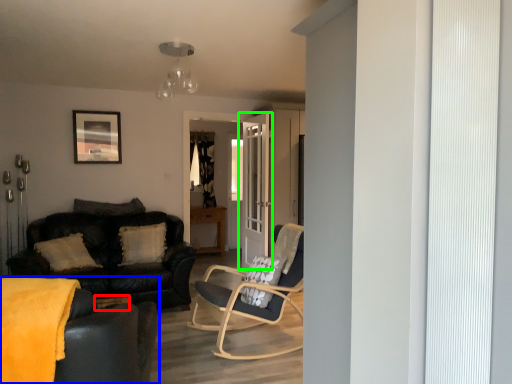
Question: Considering the real-world distances, which object is farthest from side table (highlighted by a red box)? studio couch (highlighted by a blue box) or door (highlighted by a green box)?

Choices:
 (A) studio couch
 (B) door

Answer: (B)